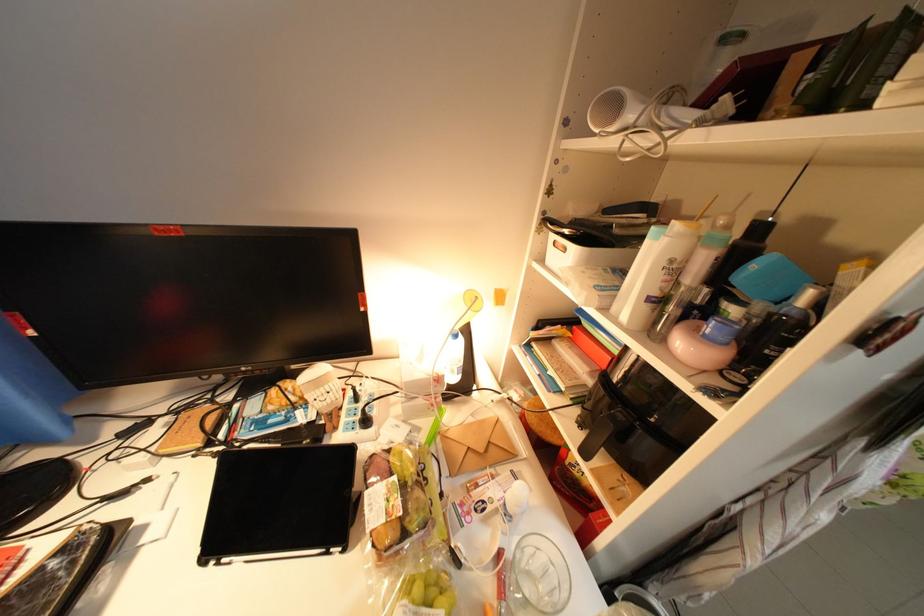
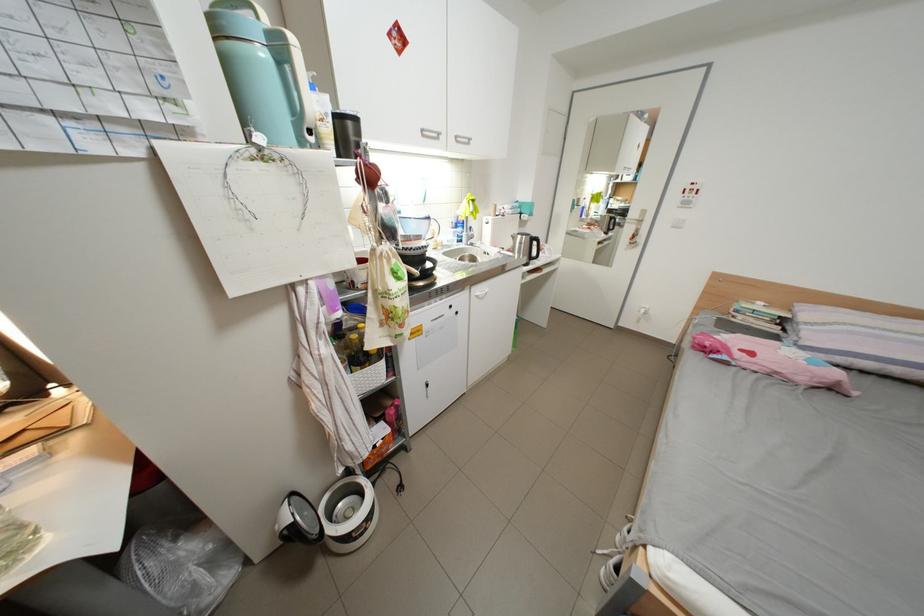
Question: The first image is from the beginning of the video and the second image is from the end. How did the camera likely rotate when shooting the video?

Choices:
 (A) Left
 (B) Right
 (C) Up
 (D) Down

Answer: (B)